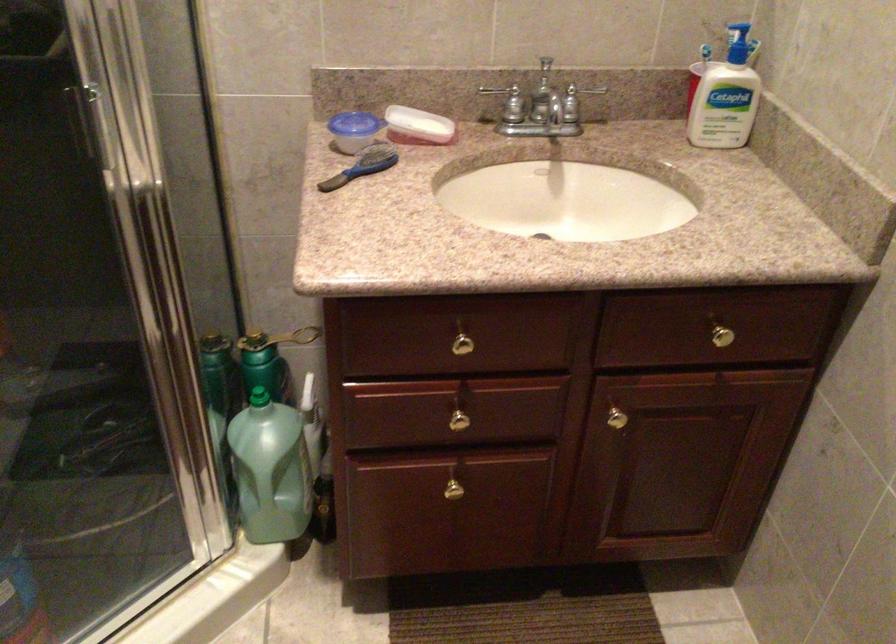
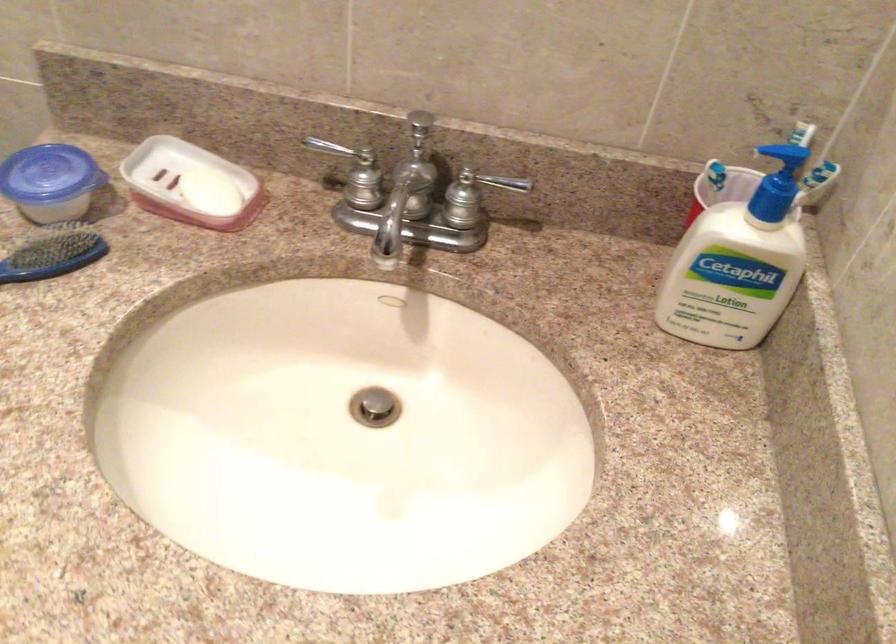
Question: The first image is from the beginning of the video and the second image is from the end. How did the camera likely rotate when shooting the video?

Choices:
 (A) Left
 (B) Right
 (C) Up
 (D) Down

Answer: (D)